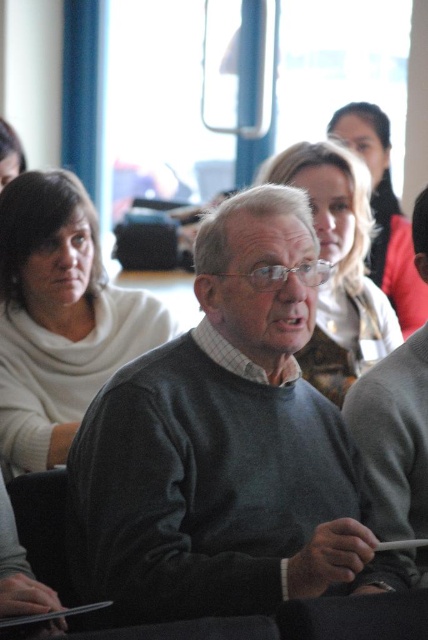
Question: Does dark gray sweater at center have a greater width compared to white sweater at left?

Choices:
 (A) yes
 (B) no

Answer: (A)

Question: Can you confirm if white sweater at left is wider than smooth beige sweater at center?

Choices:
 (A) yes
 (B) no

Answer: (A)

Question: Estimate the real-world distances between objects in this image. Which object is closer to the smooth beige sweater at center?

Choices:
 (A) white sweater at left
 (B) dark gray sweater at center
 (C) matte beige sweater at center

Answer: (C)

Question: Which of the following is the farthest from the observer?

Choices:
 (A) matte beige sweater at center
 (B) smooth beige sweater at center
 (C) dark gray sweater at center
 (D) white sweater at left

Answer: (B)

Question: Considering the relative positions of white sweater at left and smooth beige sweater at center in the image provided, where is white sweater at left located with respect to smooth beige sweater at center?

Choices:
 (A) left
 (B) right

Answer: (A)

Question: Which point is farther to the camera?

Choices:
 (A) white sweater at left
 (B) dark gray sweater at center

Answer: (A)